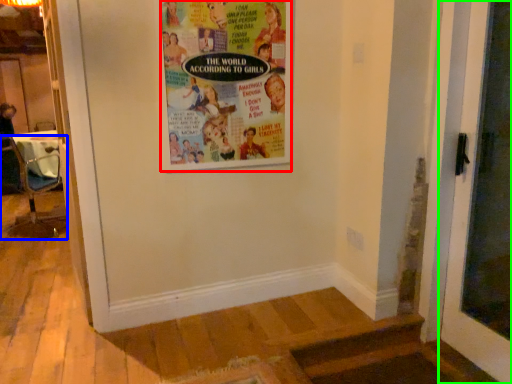
Question: Estimate the real-world distances between objects in this image. Which object is farther from poster (highlighted by a red box), chair (highlighted by a blue box) or door (highlighted by a green box)?

Choices:
 (A) chair
 (B) door

Answer: (A)